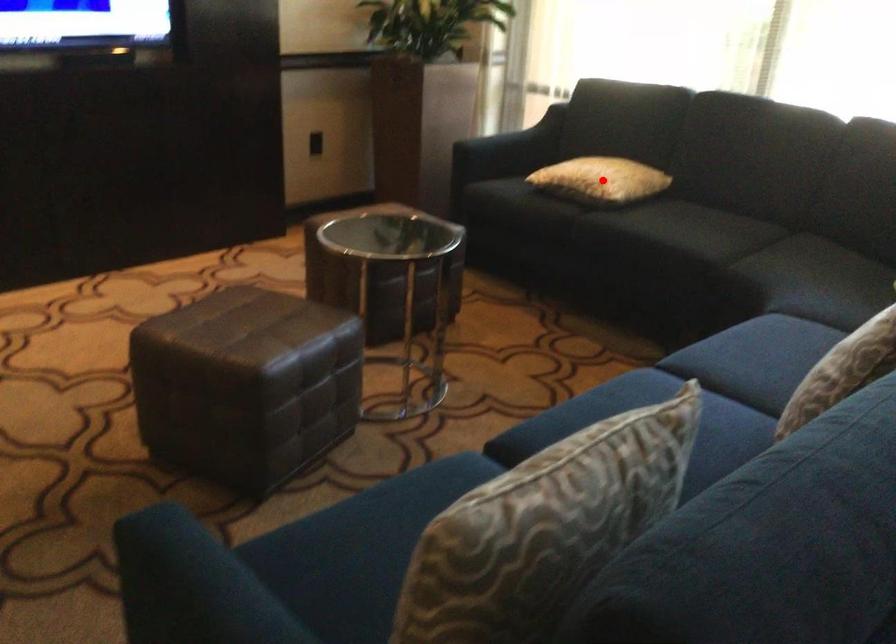
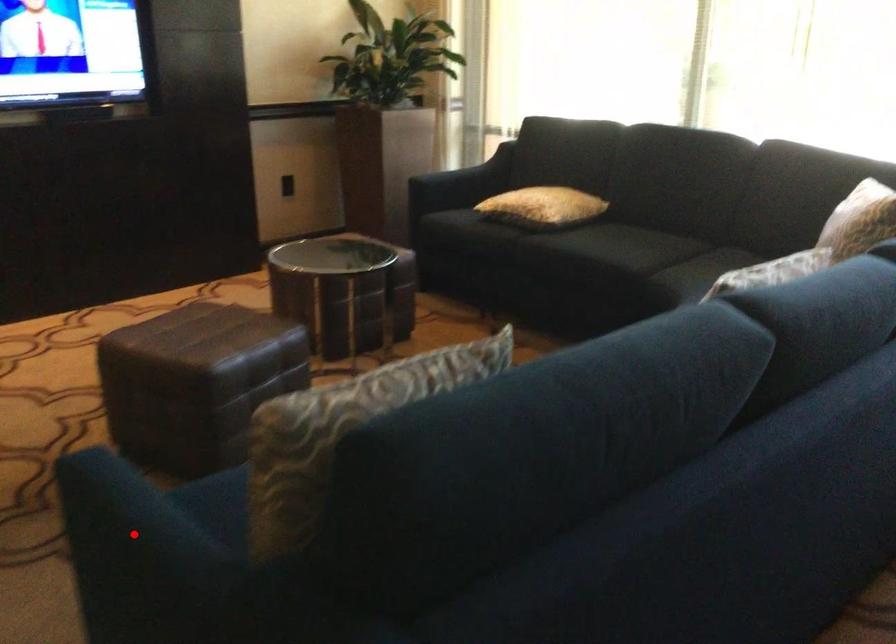
I am providing you with two images of the same scene from different viewpoints. A red point is marked on the first image and another point is marked on the second image. Are the points marked in image1 and image2 representing the same 3D position?

No